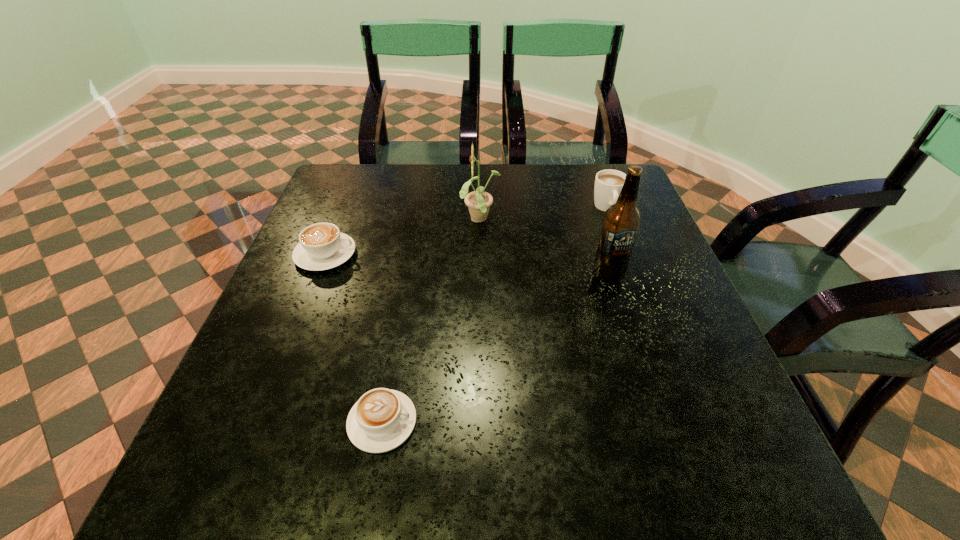
The image size is (960, 540). Identify the location of beer bottle. click(622, 220).

Locate an element on the screen. The height and width of the screenshot is (540, 960). the second tallest object is located at coordinates (478, 202).

Find the location of a particular element. Image resolution: width=960 pixels, height=540 pixels. the third object from right to left is located at coordinates (478, 202).

Identify the location of the tallest cappuccino. The height and width of the screenshot is (540, 960). (608, 183).

This screenshot has height=540, width=960. In order to click on the third tallest object in this screenshot , I will do `click(608, 183)`.

Locate an element on the screen. the second shortest object is located at coordinates (322, 246).

Locate an element on the screen. the second nearest cappuccino is located at coordinates (322, 246).

This screenshot has height=540, width=960. I want to click on the nearest cappuccino, so click(x=382, y=419).

Where is `the shortest object`? This screenshot has width=960, height=540. the shortest object is located at coordinates (382, 419).

You are a GUI agent. You are given a task and a screenshot of the screen. Output one action in this format:
    pyautogui.click(x=<x>, y=<y>)
    Task: Click on the free spot located on the label of the tallest object
    The width and height of the screenshot is (960, 540).
    Given the screenshot: What is the action you would take?
    pyautogui.click(x=660, y=441)